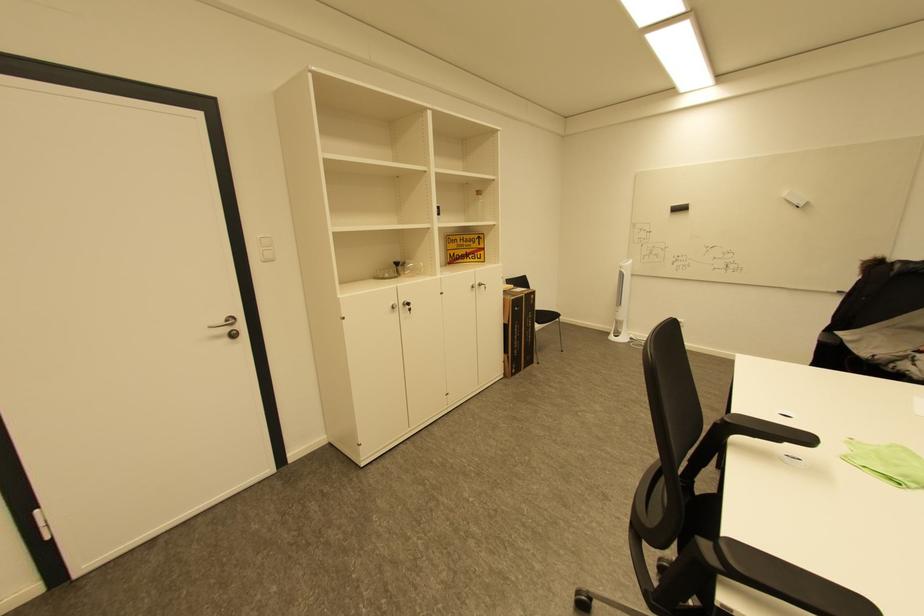
The location [399,270] corresponds to which object?

This point indicates the clear glass bottle.